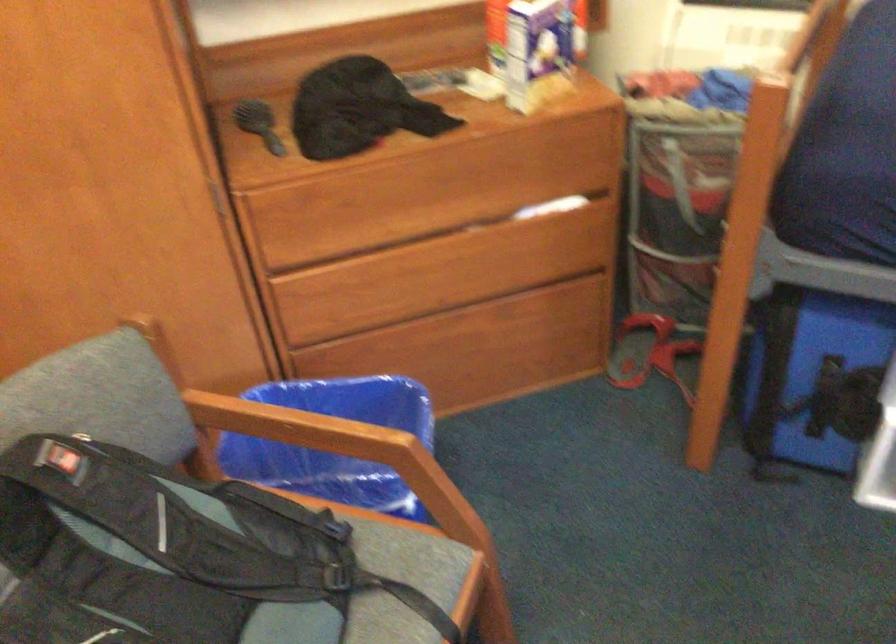
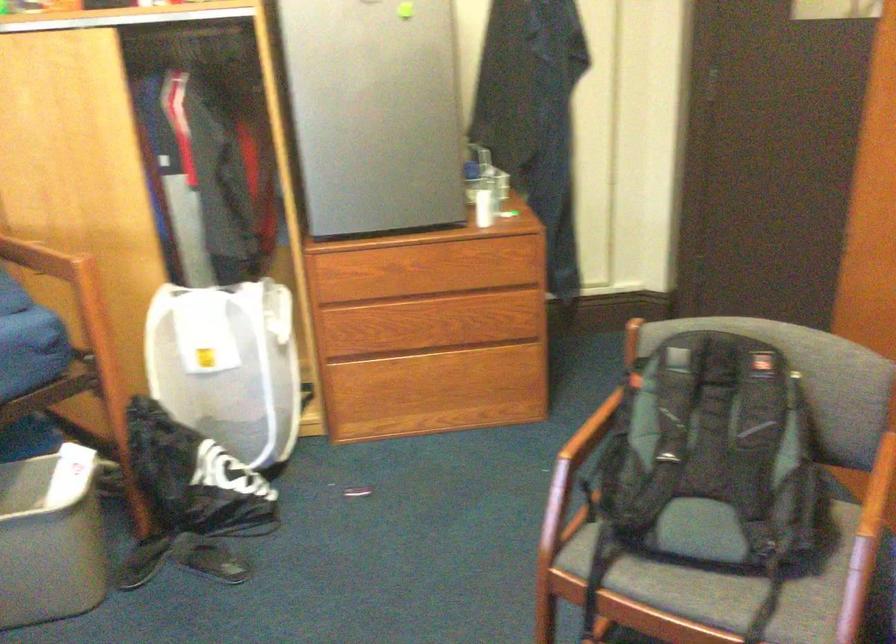
The point at (356,442) is marked in the first image. Where is the corresponding point in the second image?

(871, 520)